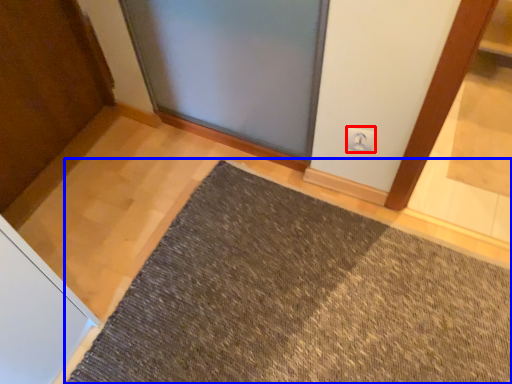
Question: Which object is closer to the camera taking this photo, electric outlet (highlighted by a red box) or mat (highlighted by a blue box)?

Choices:
 (A) electric outlet
 (B) mat

Answer: (B)